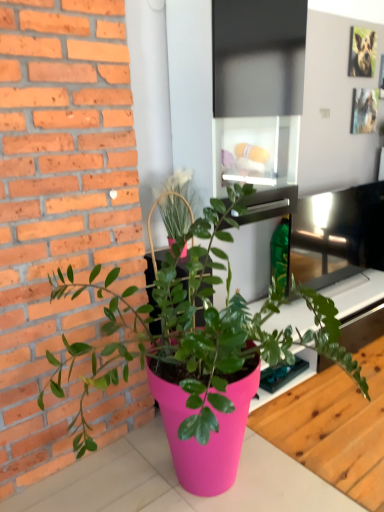
Question: From the image's perspective, is pink plastic table at lower center located above pink matte pot at center?

Choices:
 (A) yes
 (B) no

Answer: (B)

Question: From a real-world perspective, is pink plastic table at lower center below pink matte pot at center?

Choices:
 (A) no
 (B) yes

Answer: (B)

Question: Is pink plastic table at lower center aimed at pink matte pot at center?

Choices:
 (A) no
 (B) yes

Answer: (B)

Question: Is pink plastic table at lower center in front of pink matte pot at center?

Choices:
 (A) no
 (B) yes

Answer: (A)

Question: Considering the relative positions of pink plastic table at lower center and pink matte pot at center in the image provided, is pink plastic table at lower center to the left of pink matte pot at center from the viewer's perspective?

Choices:
 (A) yes
 (B) no

Answer: (B)

Question: Is the depth of pink plastic table at lower center greater than that of pink matte pot at center?

Choices:
 (A) yes
 (B) no

Answer: (A)

Question: Is pink matte pot at center oriented towards pink plastic table at lower center?

Choices:
 (A) no
 (B) yes

Answer: (A)

Question: Is pink matte pot at center outside of pink plastic table at lower center?

Choices:
 (A) no
 (B) yes

Answer: (B)

Question: Does pink matte pot at center lie behind pink plastic table at lower center?

Choices:
 (A) no
 (B) yes

Answer: (A)

Question: Considering the relative sizes of pink matte pot at center and pink plastic table at lower center in the image provided, is pink matte pot at center taller than pink plastic table at lower center?

Choices:
 (A) yes
 (B) no

Answer: (A)

Question: Is pink matte pot at center bigger than pink plastic table at lower center?

Choices:
 (A) no
 (B) yes

Answer: (B)

Question: Would you say pink matte pot at center is a long distance from pink plastic table at lower center?

Choices:
 (A) no
 (B) yes

Answer: (A)

Question: From the image's perspective, relative to pink matte pot at center, is pink plastic table at lower center above or below?

Choices:
 (A) below
 (B) above

Answer: (A)